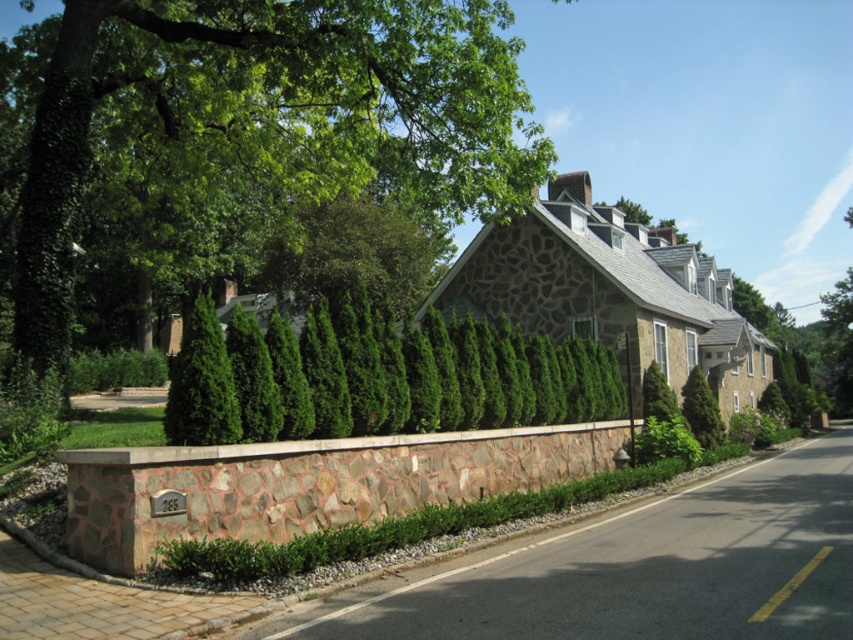
Can you confirm if green leafy tree at upper left is positioned to the right of green coniferous hedge at center?

In fact, green leafy tree at upper left is to the left of green coniferous hedge at center.

Between green leafy tree at upper left and green coniferous hedge at center, which one is positioned lower?

Positioned lower is green coniferous hedge at center.

Does point (252, 177) come in front of point (424, 412)?

No, it is behind (424, 412).

Find the location of a particular element. The image size is (853, 640). green leafy tree at upper left is located at coordinates (251, 138).